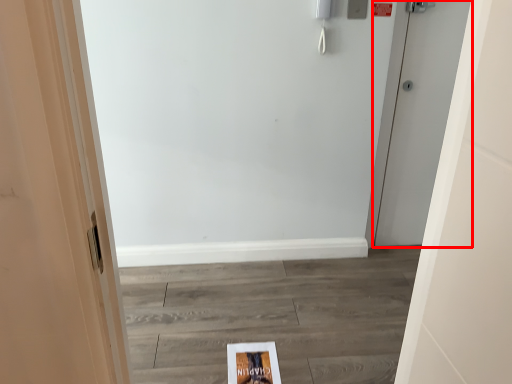
Question: Considering the relative positions of door (annotated by the red box) and flyer in the image provided, where is door (annotated by the red box) located with respect to the staircase?

Choices:
 (A) right
 (B) left

Answer: (A)